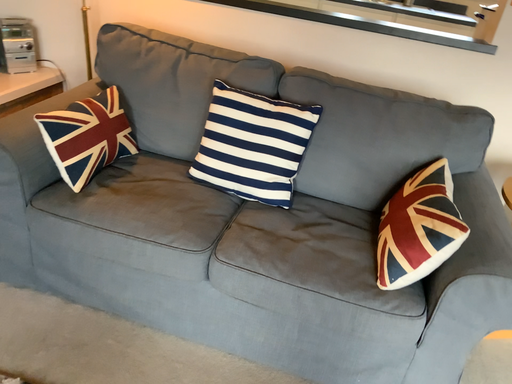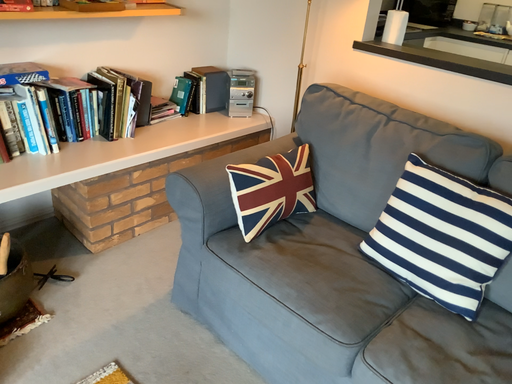
Question: Which way did the camera rotate in the video?

Choices:
 (A) rotated downward
 (B) rotated upward

Answer: (B)